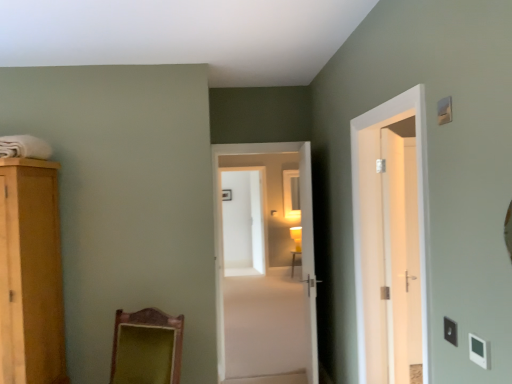
Question: Does white fabric at upper left appear on the right side of matte wooden table at center?

Choices:
 (A) yes
 (B) no

Answer: (B)

Question: Does white fabric at upper left have a greater height compared to matte wooden table at center?

Choices:
 (A) yes
 (B) no

Answer: (B)

Question: Can you confirm if white fabric at upper left is positioned to the left of matte wooden table at center?

Choices:
 (A) no
 (B) yes

Answer: (B)

Question: Is matte wooden table at center surrounded by white fabric at upper left?

Choices:
 (A) yes
 (B) no

Answer: (B)

Question: Is the depth of white fabric at upper left less than that of matte wooden table at center?

Choices:
 (A) no
 (B) yes

Answer: (B)

Question: Considering the relative sizes of white fabric at upper left and matte wooden table at center in the image provided, is white fabric at upper left wider than matte wooden table at center?

Choices:
 (A) yes
 (B) no

Answer: (A)

Question: From a real-world perspective, is white fabric at upper left physically below white plastic light switch at lower right, positioned as the 1th light switch in front-to-back order?

Choices:
 (A) no
 (B) yes

Answer: (A)

Question: Is white fabric at upper left facing towards white plastic light switch at lower right, acting as the third light switch starting from the top?

Choices:
 (A) yes
 (B) no

Answer: (B)

Question: Can white plastic light switch at lower right, positioned as the 1th light switch in front-to-back order, be found inside white fabric at upper left?

Choices:
 (A) yes
 (B) no

Answer: (B)

Question: Does white fabric at upper left have a greater height compared to white plastic light switch at lower right, positioned as the 1th light switch in front-to-back order?

Choices:
 (A) yes
 (B) no

Answer: (A)

Question: From a real-world perspective, is white fabric at upper left positioned over white plastic light switch at lower right, which ranks as the 3th light switch in back-to-front order, based on gravity?

Choices:
 (A) yes
 (B) no

Answer: (A)

Question: Is white fabric at upper left positioned beyond the bounds of white plastic light switch at lower right, acting as the third light switch starting from the top?

Choices:
 (A) yes
 (B) no

Answer: (A)

Question: Is white plastic light switch at lower right, the 3th light switch when ordered from front to back, turned away from matte yellow lampshade at center?

Choices:
 (A) no
 (B) yes

Answer: (A)